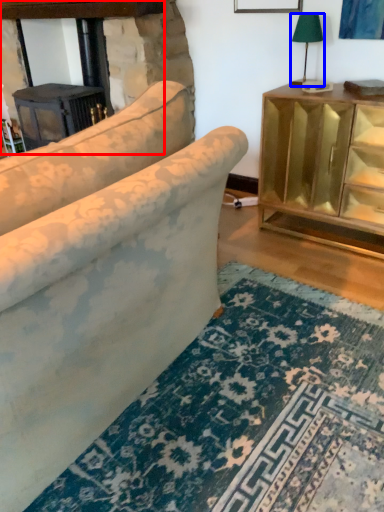
Question: Which of the following is the farthest to the observer, fireplace (highlighted by a red box) or table lamp (highlighted by a blue box)?

Choices:
 (A) fireplace
 (B) table lamp

Answer: (A)